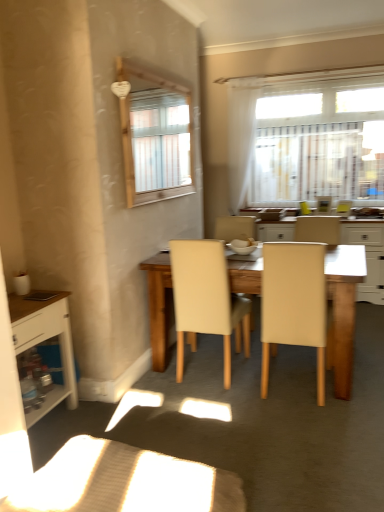
Where is `white wood cabinet at left`? The height and width of the screenshot is (512, 384). white wood cabinet at left is located at coordinates (45, 340).

Image resolution: width=384 pixels, height=512 pixels. Describe the element at coordinates (293, 303) in the screenshot. I see `beige leather chair at center, placed as the 2th chair when sorted from left to right` at that location.

From the picture: What is the approximate width of beige leather chair at center, the first chair in the right-to-left sequence?

The width of beige leather chair at center, the first chair in the right-to-left sequence, is 23.31 inches.

In order to face wooden table at center, should I rotate leftwards or rightwards?

Rotate your view right by about 8.763°.

Where is `light beige leather table at center`? The image size is (384, 512). light beige leather table at center is located at coordinates (367, 254).

Identify the location of white glossy bowl at center. The height and width of the screenshot is (512, 384). (243, 246).

The width and height of the screenshot is (384, 512). What do you see at coordinates (243, 246) in the screenshot?
I see `white glossy bowl at center` at bounding box center [243, 246].

Where is `beige leather chair at center, which appears as the 2th chair when viewed from the right`? The height and width of the screenshot is (512, 384). beige leather chair at center, which appears as the 2th chair when viewed from the right is located at coordinates (206, 300).

Can you confirm if white wood cabinet at left is wider than beige leather chair at center, the 1th chair positioned from the left?

No.

Measure the distance from white wood cabinet at left to beige leather chair at center, the 1th chair positioned from the left.

white wood cabinet at left and beige leather chair at center, the 1th chair positioned from the left, are 33.07 inches apart.

Is white wood cabinet at left situated inside beige leather chair at center, which appears as the 2th chair when viewed from the right, or outside?

white wood cabinet at left cannot be found inside beige leather chair at center, which appears as the 2th chair when viewed from the right.

From the image's perspective, is white wood cabinet at left above or below beige leather chair at center, which appears as the 2th chair when viewed from the right?

white wood cabinet at left is below beige leather chair at center, which appears as the 2th chair when viewed from the right.

Looking at this image, how many degrees apart are the facing directions of beige leather chair at center, placed as the 2th chair when sorted from left to right, and white wood cabinet at left?

They differ by 92.8 degrees in their facing directions.

Based on the photo, in the image, is beige leather chair at center, the first chair in the right-to-left sequence, positioned in front of or behind white wood cabinet at left?

Clearly, beige leather chair at center, the first chair in the right-to-left sequence, is behind white wood cabinet at left.

Which object is positioned more to the right, beige leather chair at center, placed as the 2th chair when sorted from left to right, or white wood cabinet at left?

beige leather chair at center, placed as the 2th chair when sorted from left to right.

From a real-world perspective, is beige leather chair at center, placed as the 2th chair when sorted from left to right, on top of white wood cabinet at left?

Yes, from a real-world perspective, beige leather chair at center, placed as the 2th chair when sorted from left to right, is on top of white wood cabinet at left.

Does point (185, 261) appear closer or farther from the camera than point (352, 298)?

Point (185, 261) is positioned farther from the camera compared to point (352, 298).

Between beige leather chair at center, the 1th chair positioned from the left, and wooden table at center, which one has less height?

Standing shorter between the two is wooden table at center.

Does beige leather chair at center, the 1th chair positioned from the left, appear on the left side of wooden table at center?

Correct, you'll find beige leather chair at center, the 1th chair positioned from the left, to the left of wooden table at center.

The height and width of the screenshot is (512, 384). In the image, there is a beige leather chair at center, placed as the 2th chair when sorted from left to right. Identify the location of kitchen & dining room table above it (from the image's perspective). (367, 254).

From the image's perspective, is beige leather chair at center, placed as the 2th chair when sorted from left to right, located above light beige leather table at center?

No.

Is point (353, 227) behind point (68, 333)?

Yes, it is behind point (68, 333).

Which is more to the right, light beige leather table at center or white wood cabinet at left?

Positioned to the right is light beige leather table at center.

Is light beige leather table at center positioned far away from white wood cabinet at left?

light beige leather table at center is positioned a significant distance from white wood cabinet at left.

From the image's perspective, relative to white wood cabinet at left, is beige leather chair at center, the 1th chair positioned from the left, above or below?

beige leather chair at center, the 1th chair positioned from the left, is situated higher than white wood cabinet at left in the image.

Where is `cabinetry on the left of the beige leather chair at center, which appears as the 2th chair when viewed from the right`? cabinetry on the left of the beige leather chair at center, which appears as the 2th chair when viewed from the right is located at coordinates (45, 340).

Between point (220, 274) and point (17, 323), which one is positioned behind?

The point (220, 274) is farther.

Considering the sizes of white wood cabinet at left and light beige leather table at center in the image, is white wood cabinet at left taller or shorter than light beige leather table at center?

white wood cabinet at left is shorter than light beige leather table at center.

From a real-world perspective, is white wood cabinet at left on light beige leather table at center?

Actually, white wood cabinet at left is physically below light beige leather table at center in the real world.

Considering their positions, is white wood cabinet at left located in front of or behind light beige leather table at center?

Visually, white wood cabinet at left is located in front of light beige leather table at center.

What are the coordinates of `cabinetry below the beige leather chair at center, which appears as the 2th chair when viewed from the right (from the image's perspective)` in the screenshot? It's located at (45, 340).

Identify the location of the 1st chair above the white wood cabinet at left (from the image's perspective). (293, 303).

When comparing their distances from white sheer curtain at upper center, does beige leather chair at center, the first chair in the right-to-left sequence, or light beige leather table at center seem closer?

light beige leather table at center is positioned closer to the anchor white sheer curtain at upper center.

Which object lies nearer to the anchor point beige leather chair at center, the 1th chair positioned from the left, white glossy bowl at center or light beige leather table at center?

white glossy bowl at center is positioned closer to the anchor beige leather chair at center, the 1th chair positioned from the left.

Estimate the real-world distances between objects in this image. Which object is further from wooden table at center, white wood cabinet at left or white sheer curtain at upper center?

The object further to wooden table at center is white sheer curtain at upper center.

Estimate the real-world distances between objects in this image. Which object is further from white glossy bowl at center, beige leather chair at center, the first chair in the right-to-left sequence, or wooden table at center?

Among the two, wooden table at center is located further to white glossy bowl at center.

Which object lies further to the anchor point beige leather chair at center, the 1th chair positioned from the left, wooden table at center or white glossy bowl at center?

wooden table at center.

Estimate the real-world distances between objects in this image. Which object is closer to light beige leather table at center, white sheer curtain at upper center or beige leather chair at center, the 1th chair positioned from the left?

white sheer curtain at upper center is positioned closer to the anchor light beige leather table at center.

From the image, which object appears to be nearer to light beige leather table at center, beige leather chair at center, placed as the 2th chair when sorted from left to right, or white wood cabinet at left?

The object closer to light beige leather table at center is beige leather chair at center, placed as the 2th chair when sorted from left to right.

Which object lies nearer to the anchor point white sheer curtain at upper center, white wood cabinet at left or beige leather chair at center, placed as the 2th chair when sorted from left to right?

beige leather chair at center, placed as the 2th chair when sorted from left to right, lies closer to white sheer curtain at upper center than the other object.

The width and height of the screenshot is (384, 512). Find the location of `kitchen & dining room table between white wood cabinet at left and white sheer curtain at upper center along the z-axis`. kitchen & dining room table between white wood cabinet at left and white sheer curtain at upper center along the z-axis is located at coordinates (367, 254).

Where is `tableware located between beige leather chair at center, the 1th chair positioned from the left, and white sheer curtain at upper center in the depth direction`? The image size is (384, 512). tableware located between beige leather chair at center, the 1th chair positioned from the left, and white sheer curtain at upper center in the depth direction is located at coordinates (243, 246).

This screenshot has height=512, width=384. In order to click on tableware located between beige leather chair at center, placed as the 2th chair when sorted from left to right, and light beige leather table at center in the depth direction in this screenshot , I will do `click(243, 246)`.

Locate an element on the screen. The width and height of the screenshot is (384, 512). tableware between white wood cabinet at left and beige leather chair at center, the first chair in the right-to-left sequence is located at coordinates (243, 246).